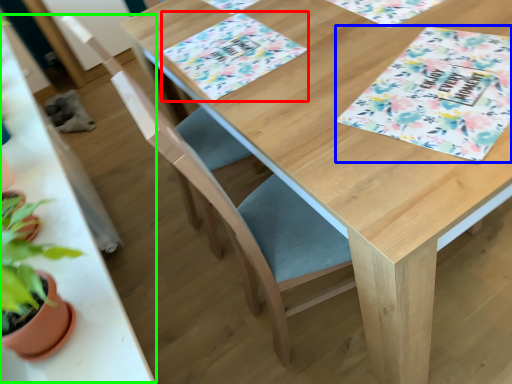
Question: Based on their relative distances, which object is nearer to place mat (highlighted by a red box)? Choose from tablecloth (highlighted by a blue box) and round table (highlighted by a green box).

Choices:
 (A) tablecloth
 (B) round table

Answer: (A)